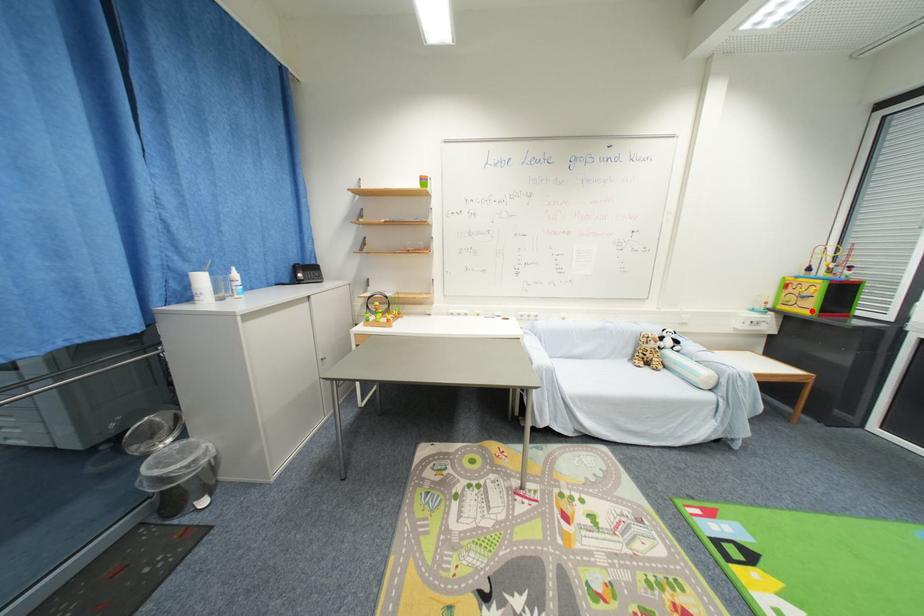
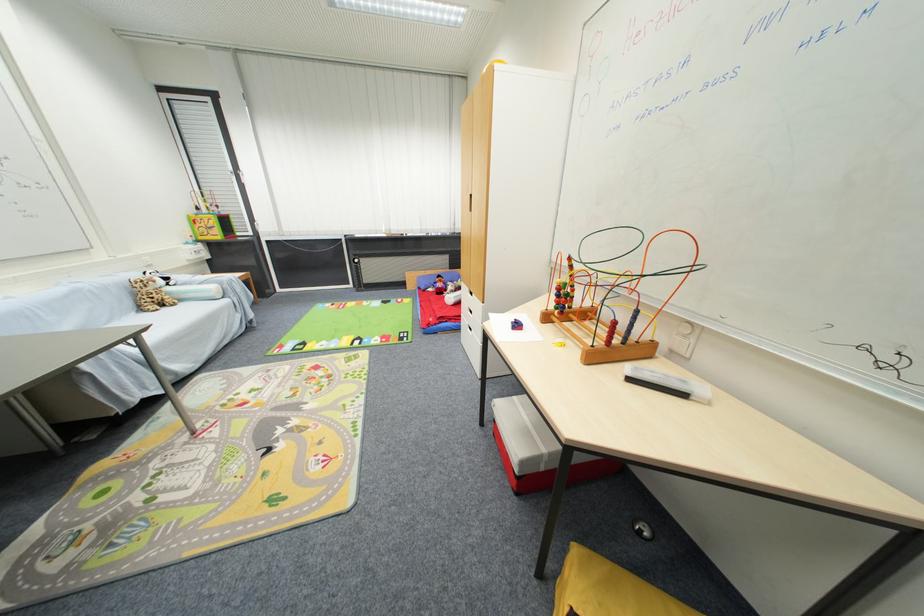
In the second image, find the point that corresponds to the highlighted location in the first image.

(223, 238)